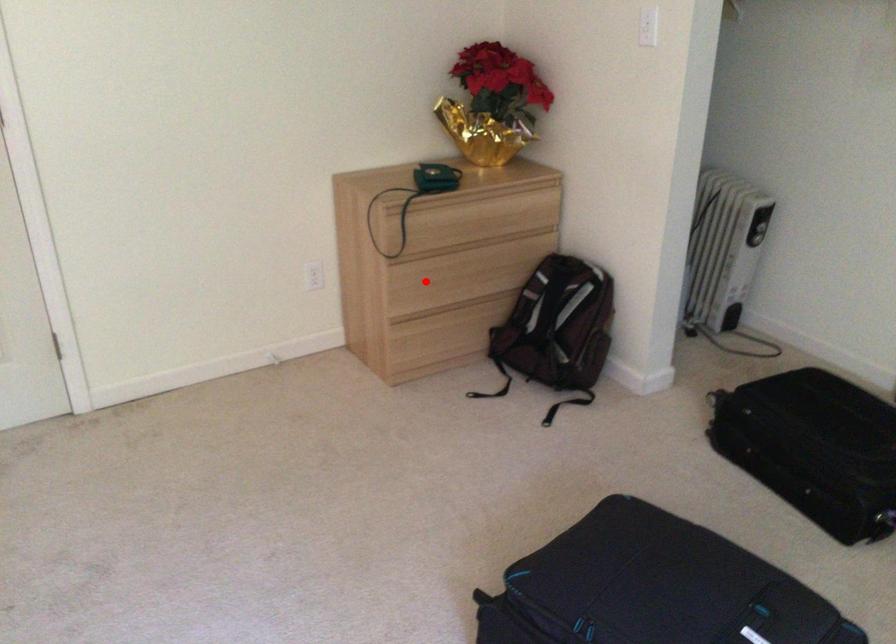
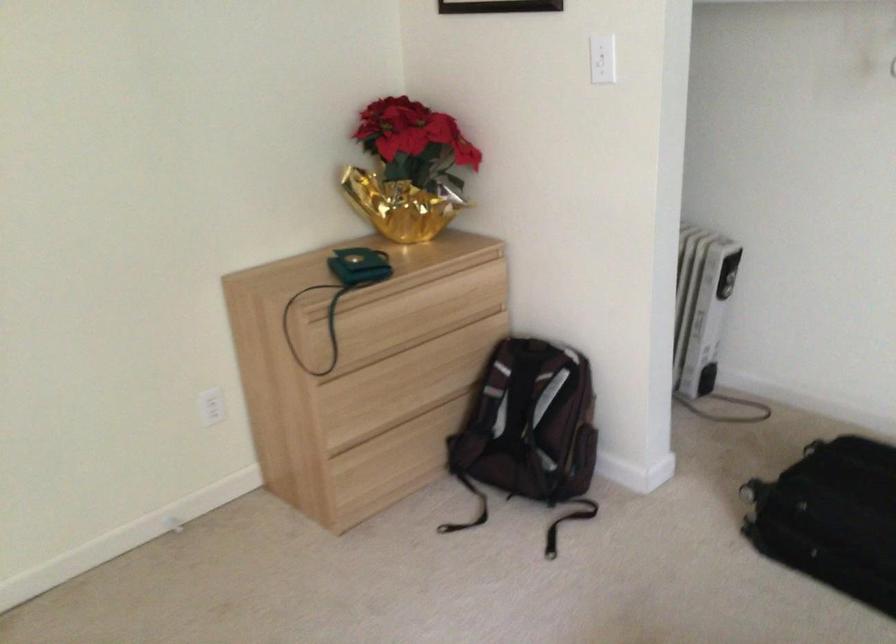
The point at the highlighted location is marked in the first image. Where is the corresponding point in the second image?

(366, 397)